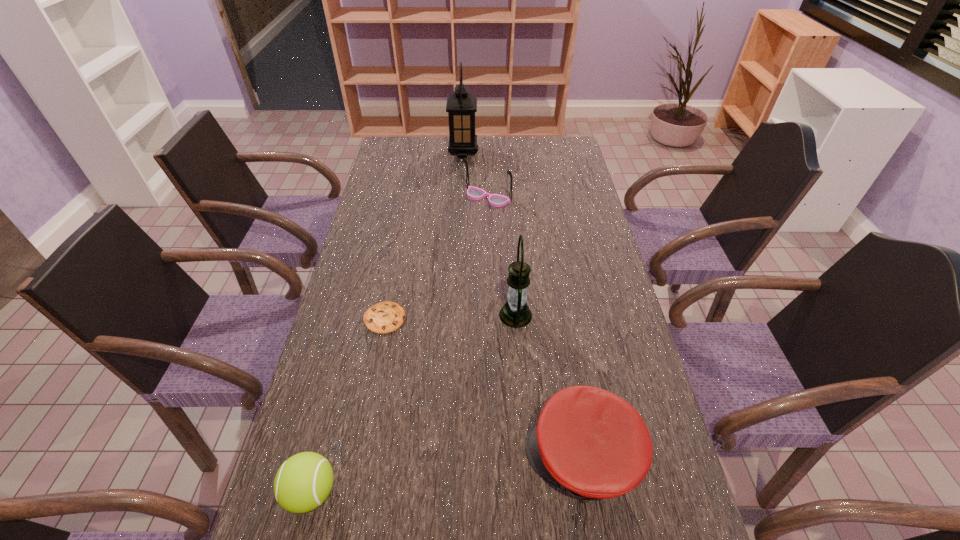
This screenshot has width=960, height=540. I want to click on free point between the fifth nearest object and the cap, so click(x=535, y=328).

Where is `free space between the cookie and the tallest object`? Image resolution: width=960 pixels, height=540 pixels. free space between the cookie and the tallest object is located at coordinates 424,235.

Where is `vacant space in between the cookie and the spectacles`? Image resolution: width=960 pixels, height=540 pixels. vacant space in between the cookie and the spectacles is located at coordinates (436, 258).

The height and width of the screenshot is (540, 960). I want to click on free space that is in between the second tallest object and the farthest object, so click(490, 234).

You are a GUI agent. You are given a task and a screenshot of the screen. Output one action in this format:
    pyautogui.click(x=<x>, y=<y>)
    Task: Click on the free space between the right lantern and the farther lantern
    The height and width of the screenshot is (540, 960).
    Given the screenshot: What is the action you would take?
    pos(490,234)

Where is `vacant space that's between the cookie and the farther lantern`? Image resolution: width=960 pixels, height=540 pixels. vacant space that's between the cookie and the farther lantern is located at coordinates (424, 235).

Select which object appears as the closest to the cap. Please provide its 2D coordinates. Your answer should be formatted as a tuple, i.e. [(x, y)], where the tuple contains the x and y coordinates of a point satisfying the conditions above.

[(515, 313)]

Locate which object is the fifth closest to the fifth shortest object. Please provide its 2D coordinates. Your answer should be formatted as a tuple, i.e. [(x, y)], where the tuple contains the x and y coordinates of a point satisfying the conditions above.

[(461, 106)]

Find the location of a particular element. The height and width of the screenshot is (540, 960). free space that satisfies the following two spatial constraints: 1. on the back side of the cookie; 2. on the right side of the farther lantern is located at coordinates (418, 152).

Where is `free space that satisfies the following two spatial constraints: 1. on the back side of the shortest object; 2. on the right side of the tennis ball`? The image size is (960, 540). free space that satisfies the following two spatial constraints: 1. on the back side of the shortest object; 2. on the right side of the tennis ball is located at coordinates (356, 318).